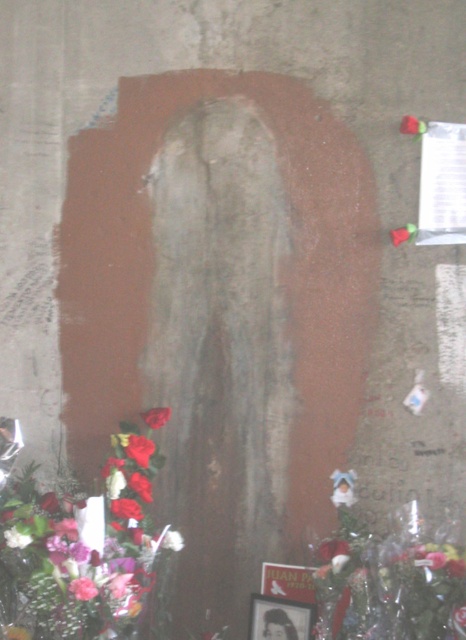
Question: Is white paper at upper right in front of red matte flower at center?

Choices:
 (A) no
 (B) yes

Answer: (B)

Question: Is smooth glossy roses at lower left wider than red matte flower at center?

Choices:
 (A) no
 (B) yes

Answer: (B)

Question: Which object appears closest to the camera in this image?

Choices:
 (A) white paper at upper right
 (B) smooth glossy roses at lower left

Answer: (B)

Question: Which object appears farthest from the camera in this image?

Choices:
 (A) red matte flower at center
 (B) red matte rose at lower left

Answer: (A)

Question: Which object appears closest to the camera in this image?

Choices:
 (A) red matte rose at lower left
 (B) red matte flower at center

Answer: (A)

Question: Does white paper at upper right come behind red matte rose at center?

Choices:
 (A) yes
 (B) no

Answer: (B)